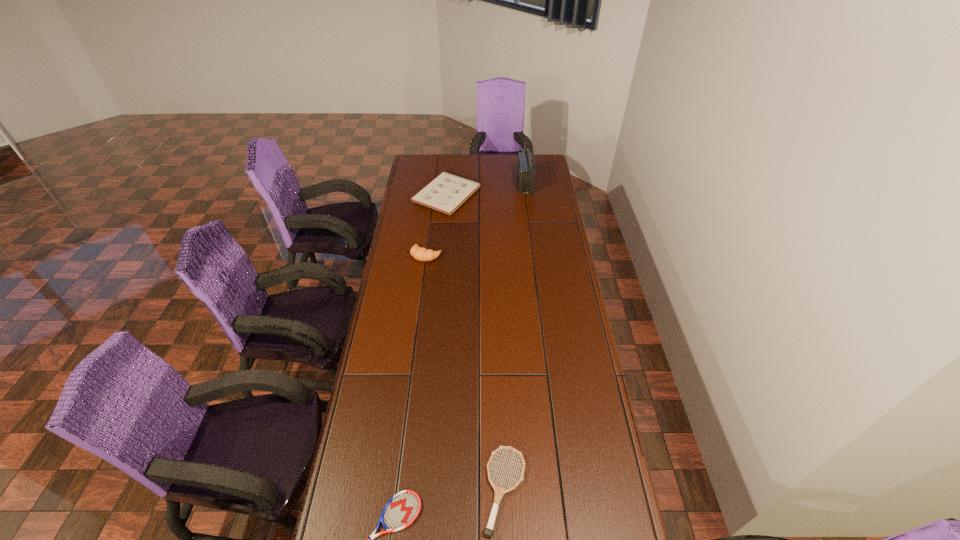
This screenshot has height=540, width=960. In order to click on free space in the image that satisfies the following two spatial constraints: 1. on the front panel of the rightmost object; 2. on the front side of the second shortest object in this screenshot , I will do `click(564, 490)`.